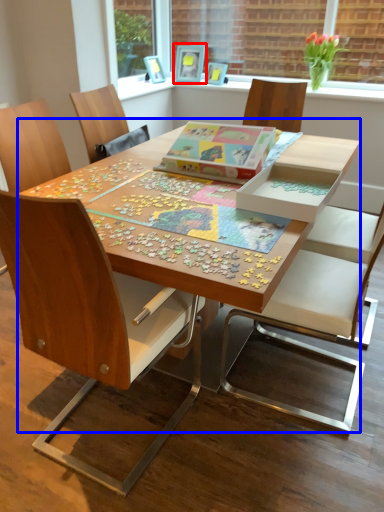
Question: Which point is further to the camera, picture frame (highlighted by a red box) or table (highlighted by a blue box)?

Choices:
 (A) picture frame
 (B) table

Answer: (A)